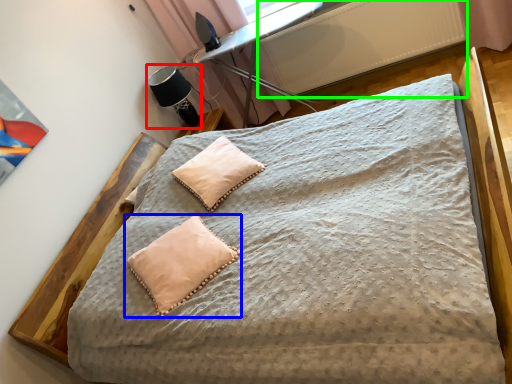
Question: Which object is positioned farthest from table lamp (highlighted by a red box)? Select from pillow (highlighted by a blue box) and radiator (highlighted by a green box).

Choices:
 (A) pillow
 (B) radiator

Answer: (A)